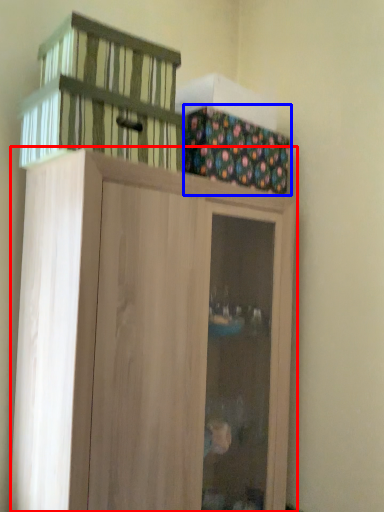
Question: Among these objects, which one is farthest to the camera, cupboard (highlighted by a red box) or cabinetry (highlighted by a blue box)?

Choices:
 (A) cupboard
 (B) cabinetry

Answer: (B)